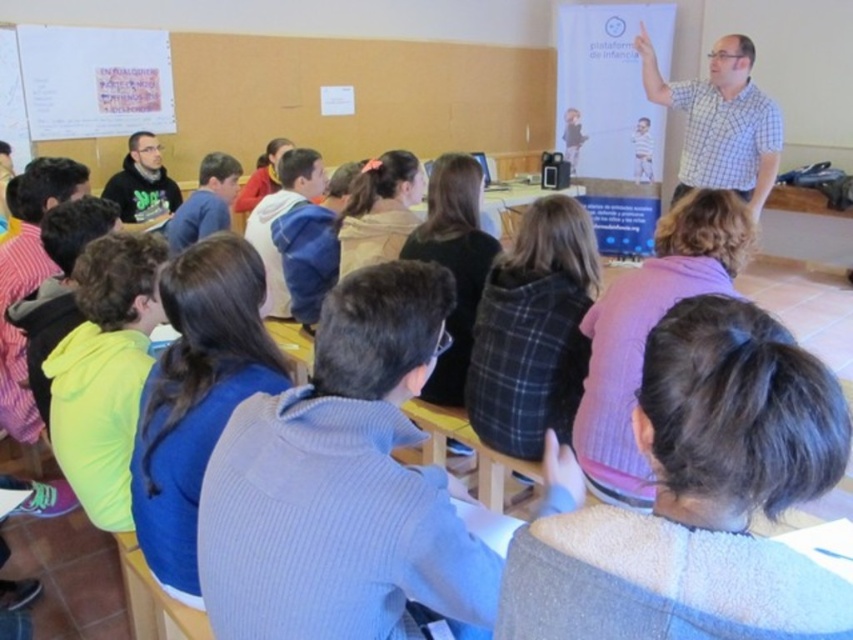
You are a student sitting in the front row of the classroom. You notice two jackets hanging on the back of the bench in front of you. Which jacket is closer to you, the blue fleece jacket at center or the matte black hoodie at center?

The blue fleece jacket at center is closer to the viewer than the matte black hoodie at center, so the blue fleece jacket at center is closer to you.

You are a student sitting in the classroom and want to know which of the two points, point (256, 211) or point (157, 141), is closer to you. Can you determine this based on the scene?

Point (256, 211) is closer to the viewer than point (157, 141).